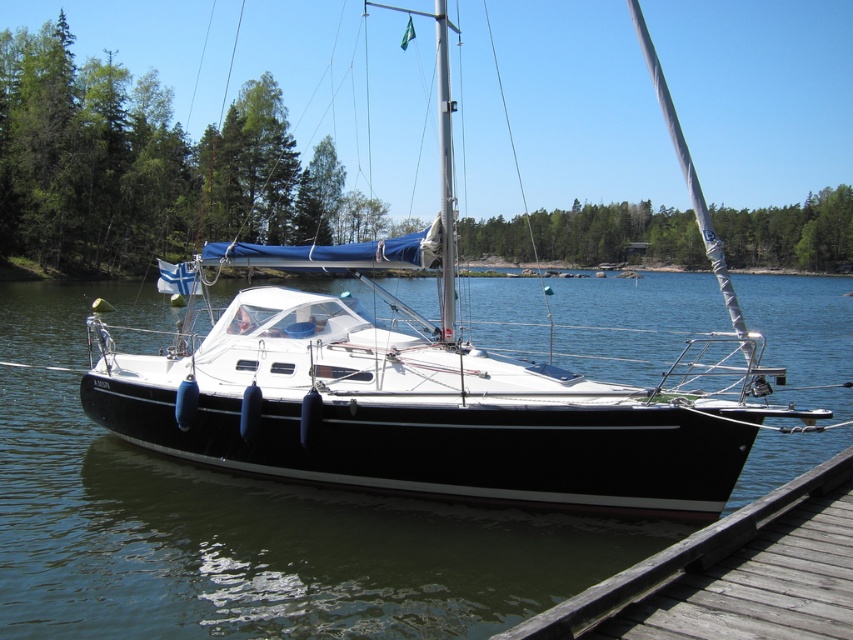
Does black glossy water at center have a smaller size compared to white glossy sailboat at center?

Indeed, black glossy water at center has a smaller size compared to white glossy sailboat at center.

Is point (155, 584) less distant than point (740, 433)?

Yes.

I want to click on black glossy water at center, so click(259, 545).

Is black glossy water at center positioned behind weathered wood dock at lower right?

Yes, it is behind weathered wood dock at lower right.

How far apart are black glossy water at center and weathered wood dock at lower right?

black glossy water at center and weathered wood dock at lower right are 17.82 meters apart.

Where is `black glossy water at center`? This screenshot has width=853, height=640. black glossy water at center is located at coordinates (259, 545).

Does white glossy sailboat at center have a smaller size compared to weathered wood dock at lower right?

No.

Can you confirm if white glossy sailboat at center is positioned below weathered wood dock at lower right?

No.

Who is more forward, [436,440] or [621,624]?

Positioned in front is point [621,624].

Identify the location of white glossy sailboat at center. The image size is (853, 640). (434, 381).